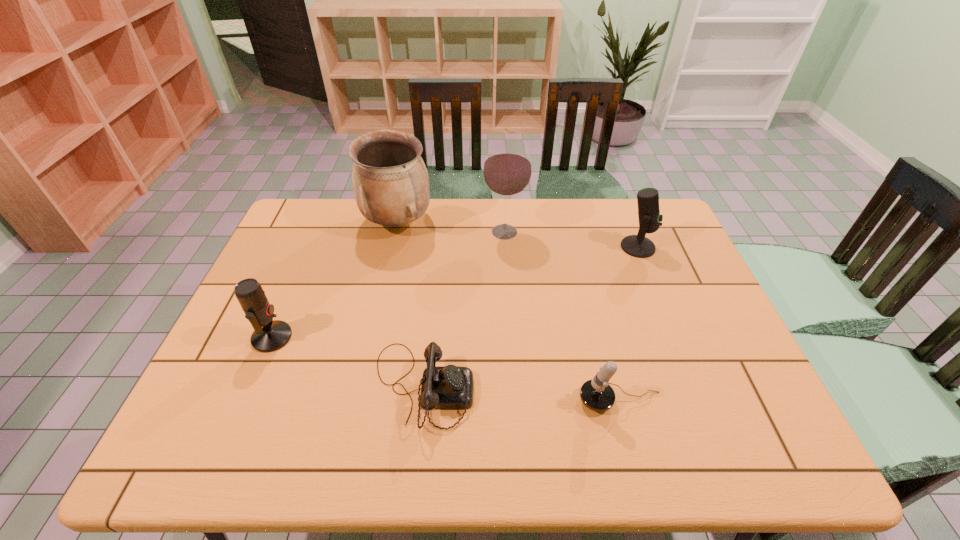
In order to click on blank area in the image that satisfies the following two spatial constraints: 1. on the front side of the second microphone from right to left; 2. on the left side of the urn in this screenshot , I will do `click(357, 401)`.

What are the coordinates of `vacant area that satisfies the following two spatial constraints: 1. on the front side of the rightmost object; 2. on the left side of the urn` in the screenshot? It's located at (392, 247).

Locate an element on the screen. vacant position in the image that satisfies the following two spatial constraints: 1. on the back side of the nearest microphone; 2. on the side of the leftmost object with the red ring is located at coordinates [x=604, y=337].